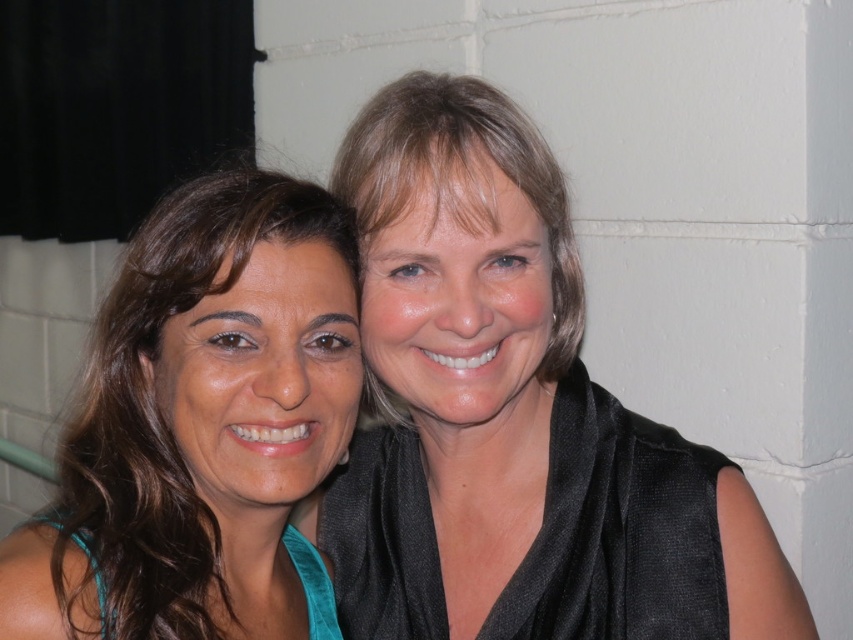
From the picture: You are a photographer adjusting your camera settings. You want to focus on the black satin scarf at upper right. What are the coordinates where you should aim your camera?

The coordinates for the black satin scarf at upper right are 0.650 on the x axis and 0.604 on the y axis.

You are a photographer adjusting the lighting for a portrait. You notice the black satin scarf at upper right and the matte black hair at upper center. Which object is closer to the camera?

The black satin scarf at upper right is positioned under the matte black hair at upper center, meaning it is closer to the camera since it appears below the hair in the frame.

You are a photographer adjusting the camera focus. The camera can only focus on objects within 5 inches of each other. You see the teal fabric top at left and the matte black hair at upper center in the frame. Will the camera be able to focus on both objects simultaneously?

The distance between the teal fabric top at left and the matte black hair at upper center is 5.85 inches. Since the camera requires objects to be within 5 inches of each other to focus, the camera cannot focus on both objects simultaneously as the distance exceeds the limit.